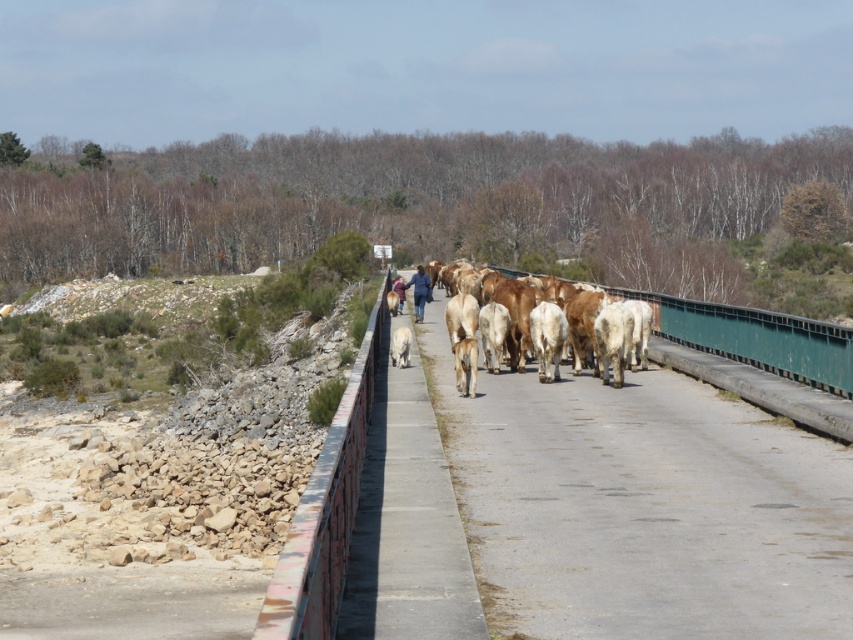
You are a farmer trying to separate your white smooth cow at center and white fur dog at center. The minimum distance required between them for safety is 5 meters. Can you confirm if they are currently safe based on their positions?

The white smooth cow at center and white fur dog at center are 4.86 meters apart from each other, which is less than the required 5 meters for safety. Therefore, they are not currently at a safe distance.

You are a farmer guiding your animals across a bridge. You notice a brown smooth cows at center and a white fur dog at center. Which animal is positioned to the right when viewed from the bridge?

The brown smooth cows at center is positioned to the right of the white fur dog at center.